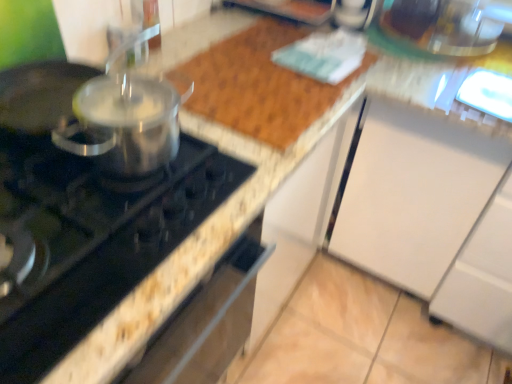
Question: Looking at the image, does black glass gas stove at left seem bigger or smaller compared to metallic silver pot at left?

Choices:
 (A) small
 (B) big

Answer: (B)

Question: Is black glass gas stove at left wider or thinner than metallic silver pot at left?

Choices:
 (A) thin
 (B) wide

Answer: (B)

Question: Is black glass gas stove at left in front of or behind metallic silver pot at left in the image?

Choices:
 (A) front
 (B) behind

Answer: (A)

Question: Considering the positions of point pyautogui.click(x=111, y=160) and point pyautogui.click(x=129, y=273), is point pyautogui.click(x=111, y=160) closer or farther from the camera than point pyautogui.click(x=129, y=273)?

Choices:
 (A) farther
 (B) closer

Answer: (A)

Question: Is metallic silver pot at left taller or shorter than black glass gas stove at left?

Choices:
 (A) short
 (B) tall

Answer: (B)

Question: Relative to black glass gas stove at left, is metallic silver pot at left in front or behind?

Choices:
 (A) behind
 (B) front

Answer: (A)

Question: Based on their sizes in the image, would you say metallic silver pot at left is bigger or smaller than black glass gas stove at left?

Choices:
 (A) small
 (B) big

Answer: (A)